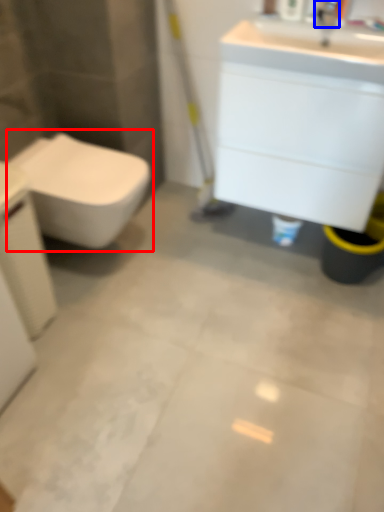
Question: Which object is closer to the camera taking this photo, toilet (highlighted by a red box) or faucet (highlighted by a blue box)?

Choices:
 (A) toilet
 (B) faucet

Answer: (B)